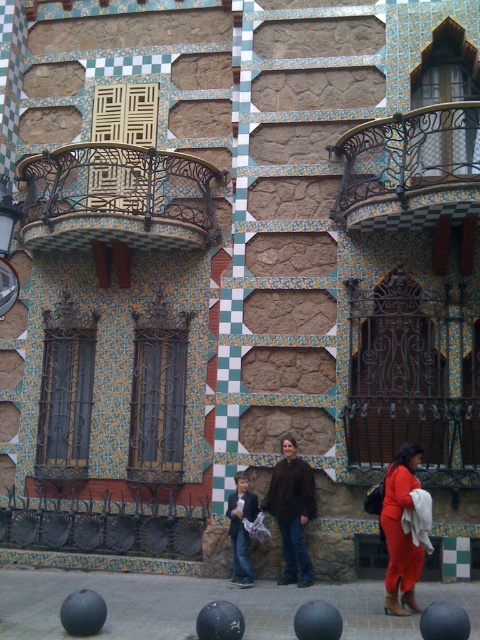
You are standing in front of the building and want to locate the dark brown wrought iron balcony at upper left. According to the coordinates provided, where exactly is it positioned?

The dark brown wrought iron balcony at upper left is positioned at point (118, 198).

You are a delivery person trying to deliver a package to the dark brown wrought iron balcony at upper left. The package is as big as the brown leather jacket at center. Will the balcony be able to hold the package?

The dark brown wrought iron balcony at upper left has a larger size compared to the brown leather jacket at center, so the balcony can hold the package since it is bigger than the jacket.

You are standing in front of the building and notice two points marked on its facade. The first point is at coordinate point (307, 564) and the second is at point (241, 528). Which point is closer to you?

Point (307, 564) is in front of point (241, 528), so it is closer to you.